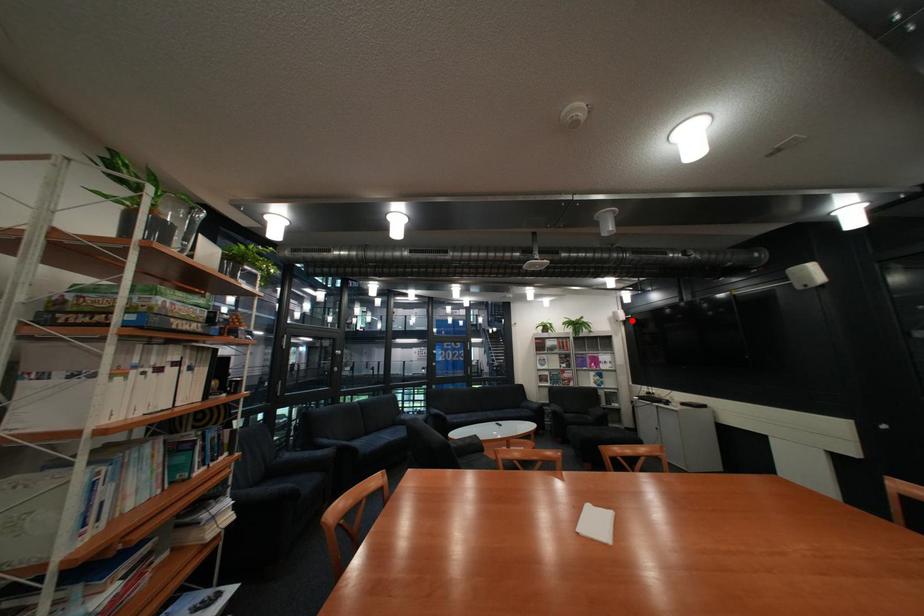
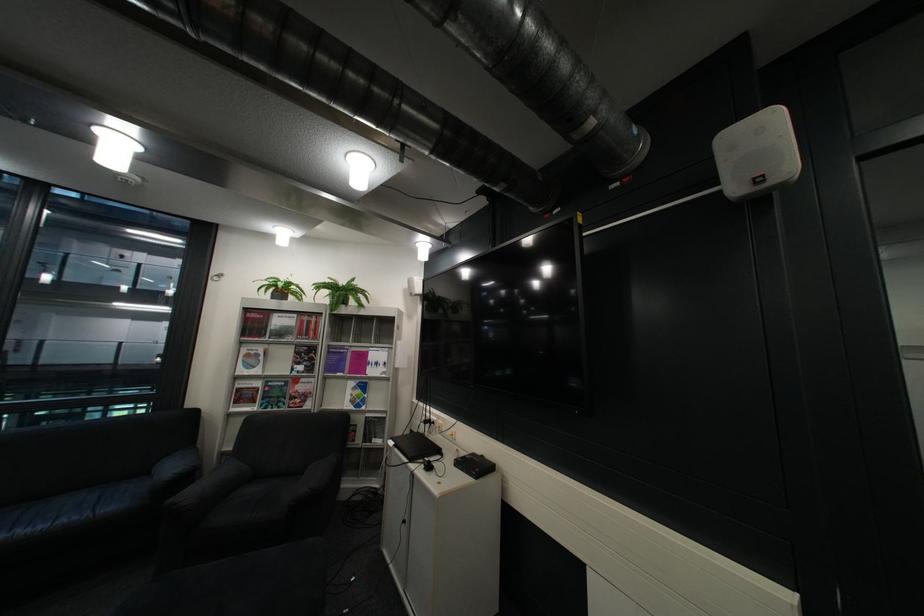
The point at the highlighted location is marked in the first image. Where is the corresponding point in the second image?

(427, 294)